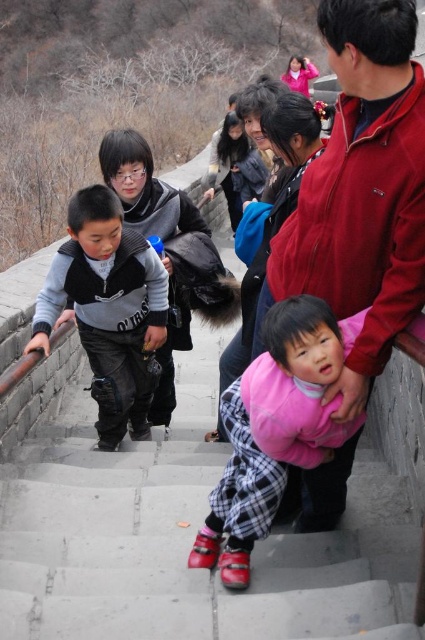
Question: Which point is closer to the camera taking this photo?

Choices:
 (A) [221, 602]
 (B) [325, 426]
 (C) [82, 320]

Answer: (A)

Question: Does pink fleece jacket at center appear under gray fleece vest at left?

Choices:
 (A) no
 (B) yes

Answer: (B)

Question: Does pink fleece jacket at center have a larger size compared to gray fleece vest at left?

Choices:
 (A) yes
 (B) no

Answer: (B)

Question: Which of the following is the closest to the observer?

Choices:
 (A) smooth concrete stairs at center
 (B) gray fleece vest at left

Answer: (A)

Question: Considering the relative positions of pink fleece jacket at center and gray fleece vest at left in the image provided, where is pink fleece jacket at center located with respect to gray fleece vest at left?

Choices:
 (A) below
 (B) above

Answer: (A)

Question: Which object appears farthest from the camera in this image?

Choices:
 (A) smooth concrete stairs at center
 (B) gray fleece vest at left
 (C) pink fleece jacket at center

Answer: (B)